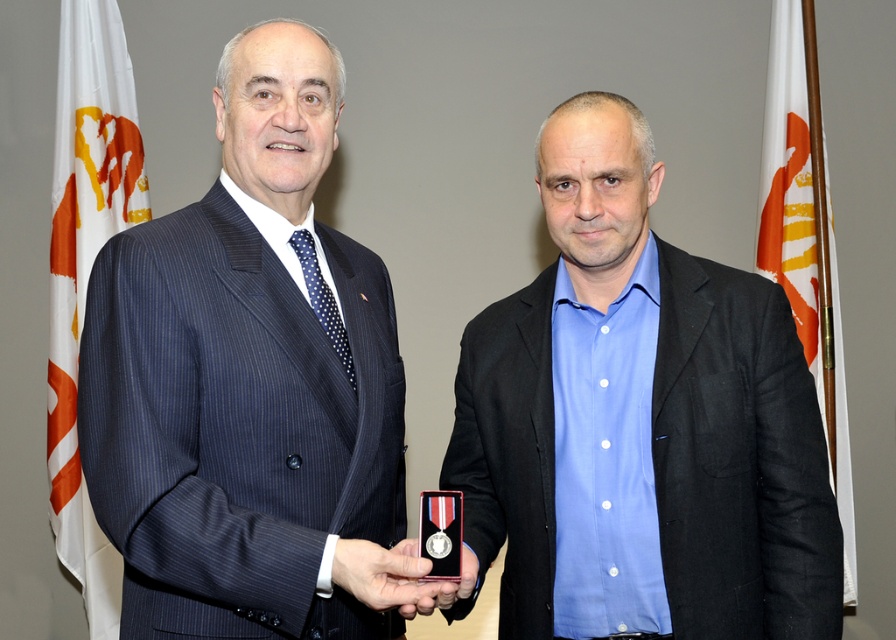
Question: Which of the following is the closest to the observer?

Choices:
 (A) dark blue pinstripe suit at center
 (B) blue matte shirt at center

Answer: (A)

Question: Can you confirm if blue matte shirt at center is wider than white fabric flag at right?

Choices:
 (A) yes
 (B) no

Answer: (A)

Question: Which point is farther to the camera?

Choices:
 (A) white fabric flag at left
 (B) blue matte shirt at center

Answer: (A)

Question: Does white fabric flag at left have a greater width compared to white fabric flag at right?

Choices:
 (A) yes
 (B) no

Answer: (B)

Question: Is blue matte shirt at center wider than white fabric flag at left?

Choices:
 (A) yes
 (B) no

Answer: (A)

Question: Based on their relative distances, which object is farther from the blue matte shirt at center?

Choices:
 (A) white fabric flag at right
 (B) white fabric flag at left
 (C) dark blue pinstripe suit at center

Answer: (B)